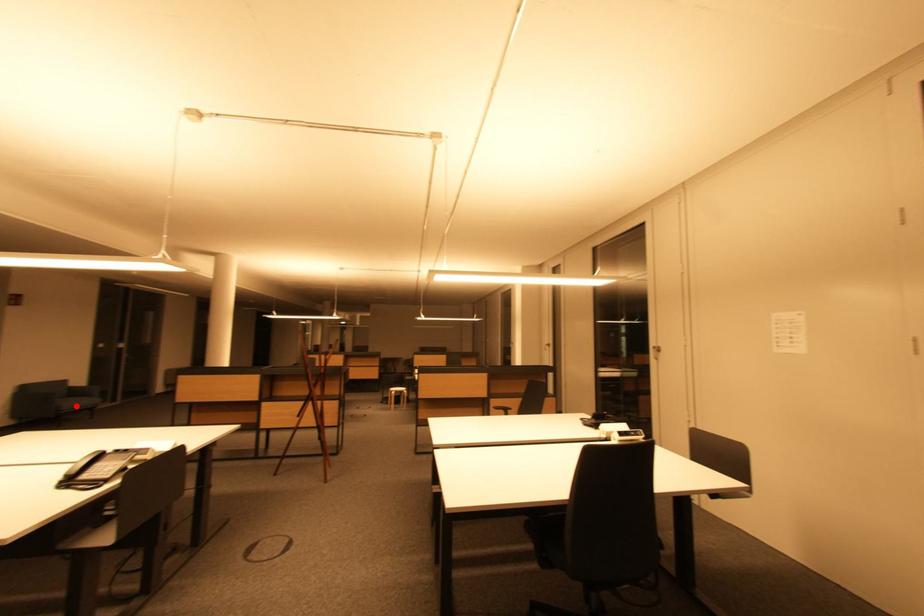
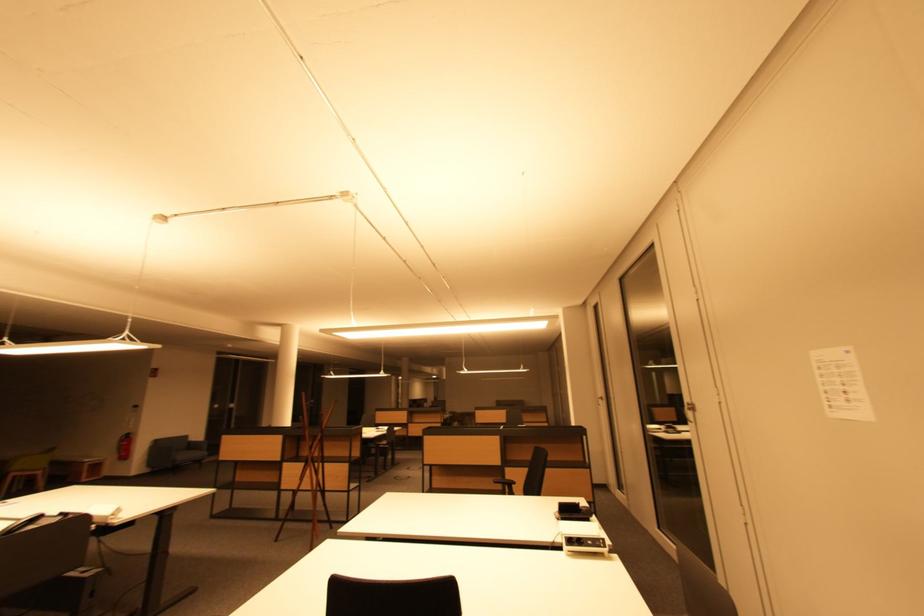
The point at the highlighted location is marked in the first image. Where is the corresponding point in the second image?

(188, 458)